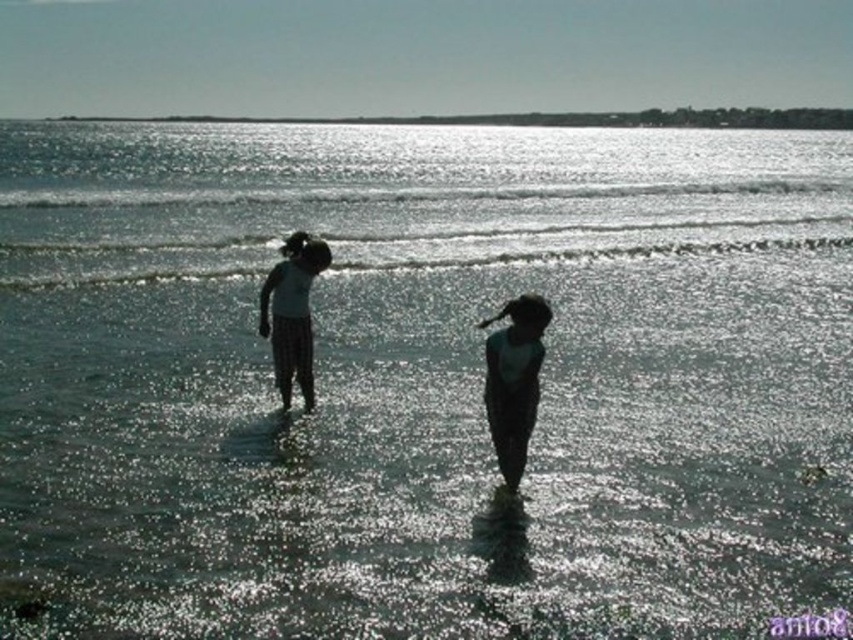
Is point (486, 413) positioned before point (286, 300)?

No, it is not.

Is matte green shirt at center above matte white shirt at center?

Actually, matte green shirt at center is below matte white shirt at center.

Locate an element on the screen. matte green shirt at center is located at coordinates (514, 380).

Locate an element on the screen. matte green shirt at center is located at coordinates [514, 380].

Between silhouette fabric children at center and matte white shirt at center, which one has less height?

matte white shirt at center

Which is below, silhouette fabric children at center or matte white shirt at center?

silhouette fabric children at center is below.

Is point (496, 406) more distant than point (297, 326)?

No, it is in front of (297, 326).

In order to click on silhouette fabric children at center in this screenshot , I will do `click(514, 380)`.

Between silhouette fabric children at center and matte green shirt at center, which one has more height?

matte green shirt at center

Does silhouette fabric children at center appear under matte green shirt at center?

Correct, silhouette fabric children at center is located below matte green shirt at center.

Which is behind, point (271, 332) or point (508, 333)?

Point (271, 332)

Where is `silhouette fabric children at center`? The image size is (853, 640). silhouette fabric children at center is located at coordinates (514, 380).